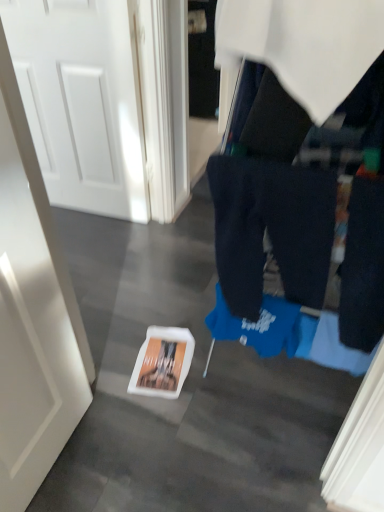
Where is `dark blue cotton trousers at center`? The width and height of the screenshot is (384, 512). dark blue cotton trousers at center is located at coordinates [x=271, y=229].

Locate an element on the screen. The image size is (384, 512). dark blue cotton trousers at center is located at coordinates (271, 229).

Which object is closer to the camera taking this photo, white glossy door at upper left, which is the second door from bottom to top, or blue fabric at center?

blue fabric at center is more forward.

Is blue fabric at center at the back of white glossy door at upper left, the first door when ordered from top to bottom?

white glossy door at upper left, the first door when ordered from top to bottom, does not have its back to blue fabric at center.

In terms of width, does white glossy door at upper left, the first door when ordered from top to bottom, look wider or thinner when compared to blue fabric at center?

white glossy door at upper left, the first door when ordered from top to bottom, is thinner than blue fabric at center.

Is white glossy door at upper left, the first door when ordered from top to bottom, not within blue fabric at center?

Yes, white glossy door at upper left, the first door when ordered from top to bottom, is outside of blue fabric at center.

Considering the relative sizes of white glossy door at left, the first door ordered from the bottom, and white glossy door at upper left, which is the second door from bottom to top, in the image provided, is white glossy door at left, the first door ordered from the bottom, smaller than white glossy door at upper left, which is the second door from bottom to top,?

Yes, white glossy door at left, the first door ordered from the bottom, is smaller than white glossy door at upper left, which is the second door from bottom to top.

Considering the relative sizes of white glossy door at left, marked as the 2th door in a back-to-front arrangement, and white glossy door at upper left, which is the 1th door in back-to-front order, in the image provided, is white glossy door at left, marked as the 2th door in a back-to-front arrangement, wider than white glossy door at upper left, which is the 1th door in back-to-front order,?

Yes, white glossy door at left, marked as the 2th door in a back-to-front arrangement, is wider than white glossy door at upper left, which is the 1th door in back-to-front order.

In the scene shown: Which is more to the left, white glossy door at left, the first door ordered from the bottom, or white glossy door at upper left, which is the second door from bottom to top?

white glossy door at upper left, which is the second door from bottom to top, is more to the left.

Is blue fabric at center not near dark blue cotton trousers at center?

No, blue fabric at center is not far from dark blue cotton trousers at center.

Between blue fabric at center and dark blue cotton trousers at center, which one is positioned behind?

dark blue cotton trousers at center is further from the camera.

I want to click on tight below the dark blue cotton trousers at center (from a real-world perspective), so click(270, 205).

Would you say white glossy door at left, the first door ordered from the bottom, is to the left or to the right of blue fabric at center in the picture?

Based on their positions, white glossy door at left, the first door ordered from the bottom, is located to the left of blue fabric at center.

Is the surface of white glossy door at left, the first door when ordered from front to back, in direct contact with blue fabric at center?

They are not placed beside each other.

Does white glossy door at left, the first door ordered from the bottom, lie in front of blue fabric at center?

Yes, white glossy door at left, the first door ordered from the bottom, is in front of blue fabric at center.

Considering the sizes of objects white glossy door at left, marked as the 2th door in a back-to-front arrangement, and blue fabric at center in the image provided, who is thinner, white glossy door at left, marked as the 2th door in a back-to-front arrangement, or blue fabric at center?

white glossy door at left, marked as the 2th door in a back-to-front arrangement.

Does dark blue cotton trousers at center have a larger size compared to white glossy door at left, marked as the 2th door in a back-to-front arrangement?

No, dark blue cotton trousers at center is not bigger than white glossy door at left, marked as the 2th door in a back-to-front arrangement.

From the image's perspective, between dark blue cotton trousers at center and white glossy door at left, the first door when ordered from front to back, which one is located above?

dark blue cotton trousers at center.

Choose the correct answer: Is dark blue cotton trousers at center inside white glossy door at left, marked as the 2th door in a back-to-front arrangement, or outside it?

dark blue cotton trousers at center exists outside the volume of white glossy door at left, marked as the 2th door in a back-to-front arrangement.

Considering the relative positions of dark blue cotton trousers at center and white glossy door at left, the first door ordered from the bottom, in the image provided, is dark blue cotton trousers at center to the left or to the right of white glossy door at left, the first door ordered from the bottom,?

In the image, dark blue cotton trousers at center appears on the right side of white glossy door at left, the first door ordered from the bottom.

Between point (64, 120) and point (315, 261), which one is positioned in front?

The point (315, 261) is closer.

Based on their positions, is white glossy door at upper left, which is the 1th door in back-to-front order, located to the left or right of dark blue cotton trousers at center?

Based on their positions, white glossy door at upper left, which is the 1th door in back-to-front order, is located to the left of dark blue cotton trousers at center.

Is white glossy door at upper left, the first door when ordered from top to bottom, aimed at dark blue cotton trousers at center?

No, white glossy door at upper left, the first door when ordered from top to bottom, does not turn towards dark blue cotton trousers at center.

Which of these two, white glossy door at upper left, which is the second door from bottom to top, or dark blue cotton trousers at center, stands shorter?

Standing shorter between the two is dark blue cotton trousers at center.

Does dark blue cotton trousers at center turn towards blue fabric at center?

Yes, dark blue cotton trousers at center faces towards blue fabric at center.

Is dark blue cotton trousers at center smaller than blue fabric at center?

Yes.

Which object is wider, dark blue cotton trousers at center or blue fabric at center?

blue fabric at center.

Is dark blue cotton trousers at center completely or partially outside of blue fabric at center?

No, dark blue cotton trousers at center is inside or overlapping with blue fabric at center.

Identify the location of door that is the 2nd one when counting leftward from the blue fabric at center. The image size is (384, 512). (81, 101).

This screenshot has height=512, width=384. Find the location of `door that is above the white glossy door at left, the 2th door positioned from the top (from the image's perspective)`. door that is above the white glossy door at left, the 2th door positioned from the top (from the image's perspective) is located at coordinates (81, 101).

Estimate the real-world distances between objects in this image. Which object is closer to white glossy door at left, the first door ordered from the bottom, blue fabric at center or white glossy door at upper left, which is the second door from bottom to top?

The object closer to white glossy door at left, the first door ordered from the bottom, is blue fabric at center.

Based on their spatial positions, is white glossy door at left, the first door when ordered from front to back, or blue fabric at center further from white glossy door at upper left, arranged as the second door when viewed from the front?

white glossy door at left, the first door when ordered from front to back, lies further to white glossy door at upper left, arranged as the second door when viewed from the front, than the other object.

Estimate the real-world distances between objects in this image. Which object is further from dark blue cotton trousers at center, white glossy door at upper left, which is the 1th door in back-to-front order, or white glossy door at left, the first door ordered from the bottom?

Based on the image, white glossy door at upper left, which is the 1th door in back-to-front order, appears to be further to dark blue cotton trousers at center.

From the image, which object appears to be nearer to dark blue cotton trousers at center, white glossy door at left, marked as the 2th door in a back-to-front arrangement, or white glossy door at upper left, which is the second door from bottom to top?

white glossy door at left, marked as the 2th door in a back-to-front arrangement, is positioned closer to the anchor dark blue cotton trousers at center.

When comparing their distances from white glossy door at upper left, arranged as the second door when viewed from the front, does white glossy door at left, the first door when ordered from front to back, or dark blue cotton trousers at center seem closer?

Among the two, dark blue cotton trousers at center is located nearer to white glossy door at upper left, arranged as the second door when viewed from the front.

Based on their spatial positions, is dark blue cotton trousers at center or blue fabric at center further from white glossy door at upper left, which is the second door from bottom to top?

blue fabric at center.

When comparing their distances from white glossy door at left, the 2th door positioned from the top, does dark blue cotton trousers at center or white glossy door at upper left, the first door when ordered from top to bottom, seem further?

The object further to white glossy door at left, the 2th door positioned from the top, is white glossy door at upper left, the first door when ordered from top to bottom.

When comparing their distances from white glossy door at upper left, arranged as the second door when viewed from the front, does blue fabric at center or dark blue cotton trousers at center seem closer?

dark blue cotton trousers at center lies closer to white glossy door at upper left, arranged as the second door when viewed from the front, than the other object.

In order to click on trousers between white glossy door at left, marked as the 2th door in a back-to-front arrangement, and blue fabric at center in this screenshot , I will do `click(271, 229)`.

Find the location of a particular element. This screenshot has height=512, width=384. trousers located between white glossy door at upper left, arranged as the second door when viewed from the front, and blue fabric at center in the left-right direction is located at coordinates (271, 229).

Identify the location of tight between white glossy door at left, the first door ordered from the bottom, and white glossy door at upper left, the first door when ordered from top to bottom, from front to back. (270, 205).

Identify the location of trousers between white glossy door at left, marked as the 2th door in a back-to-front arrangement, and white glossy door at upper left, which is the 1th door in back-to-front order, along the z-axis. This screenshot has width=384, height=512. (271, 229).